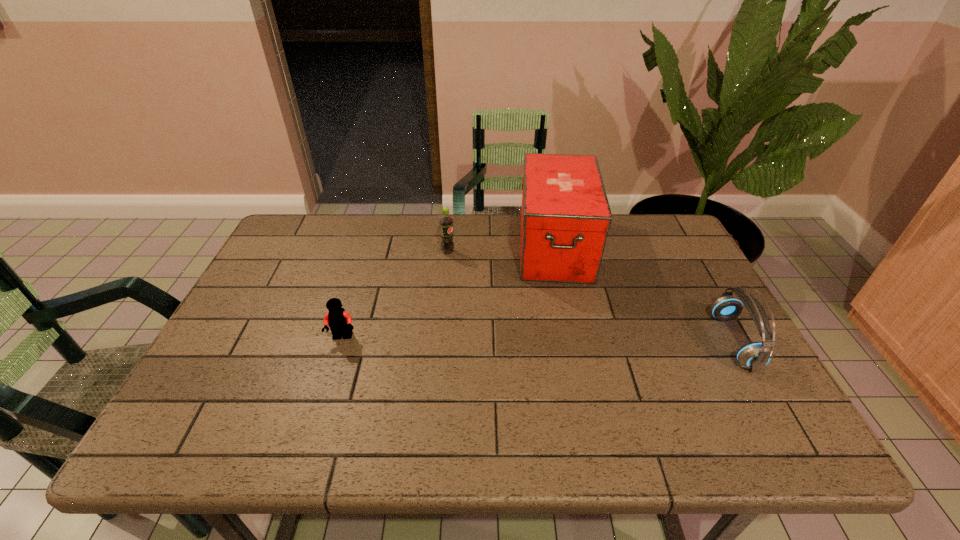
You are a GUI agent. You are given a task and a screenshot of the screen. Output one action in this format:
    pyautogui.click(x=<x>, y=<y>)
    Task: Click on the vacant space located 0.180m on the handle side of the tallest object
    
    Given the screenshot: What is the action you would take?
    pyautogui.click(x=564, y=334)

Find the location of a particular element. vacant space located on the handle side of the tallest object is located at coordinates (565, 353).

The image size is (960, 540). I want to click on vacant space located on the handle side of the tallest object, so click(565, 353).

Identify the location of vacant space located 0.300m on the front label of the soda. (531, 301).

This screenshot has height=540, width=960. In order to click on free region located on the front label of the soda in this screenshot , I will do `click(495, 280)`.

You are a GUI agent. You are given a task and a screenshot of the screen. Output one action in this format:
    pyautogui.click(x=<x>, y=<y>)
    Task: Click on the blank space located 0.080m on the front label of the soda
    
    Given the screenshot: What is the action you would take?
    pyautogui.click(x=472, y=266)

Locate an element on the screen. the first-aid kit present at the far edge is located at coordinates (565, 216).

Locate an element on the screen. The image size is (960, 540). soda positioned at the far edge is located at coordinates (447, 245).

Identify the location of object at the near edge. (755, 355).

Where is `object located at the right edge`? Image resolution: width=960 pixels, height=540 pixels. object located at the right edge is located at coordinates (755, 355).